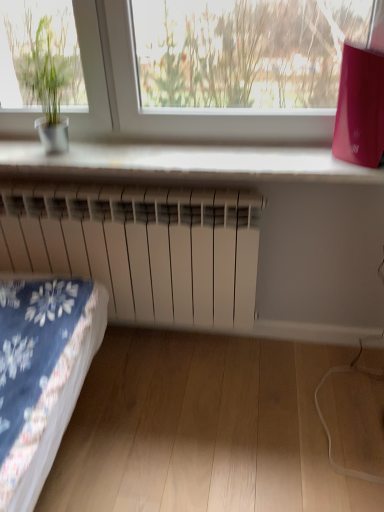
Question: From a real-world perspective, is white plastic radiator at lower center beneath white matte radiator at center?

Choices:
 (A) no
 (B) yes

Answer: (A)

Question: From the image's perspective, is white plastic radiator at lower center over white matte radiator at center?

Choices:
 (A) yes
 (B) no

Answer: (A)

Question: Does white plastic radiator at lower center have a greater height compared to white matte radiator at center?

Choices:
 (A) yes
 (B) no

Answer: (B)

Question: Could white matte radiator at center be considered to be inside white plastic radiator at lower center?

Choices:
 (A) no
 (B) yes

Answer: (A)

Question: Can you confirm if white plastic radiator at lower center is wider than white matte radiator at center?

Choices:
 (A) yes
 (B) no

Answer: (A)

Question: From the image's perspective, is white plastic radiator at lower center above or below white matte radiator at center?

Choices:
 (A) below
 (B) above

Answer: (B)

Question: Considering the positions of white plastic radiator at lower center and white matte radiator at center in the image, is white plastic radiator at lower center bigger or smaller than white matte radiator at center?

Choices:
 (A) big
 (B) small

Answer: (B)

Question: From a real-world perspective, is white plastic radiator at lower center above or below white matte radiator at center?

Choices:
 (A) below
 (B) above

Answer: (B)

Question: Is white plastic radiator at lower center in front of or behind white matte radiator at center in the image?

Choices:
 (A) front
 (B) behind

Answer: (A)

Question: From the image's perspective, is green matte plant pot at left above or below white plastic radiator at lower center?

Choices:
 (A) above
 (B) below

Answer: (A)

Question: Looking at their shapes, would you say green matte plant pot at left is wider or thinner than white plastic radiator at lower center?

Choices:
 (A) wide
 (B) thin

Answer: (B)

Question: From a real-world perspective, relative to white plastic radiator at lower center, is green matte plant pot at left vertically above or below?

Choices:
 (A) above
 (B) below

Answer: (A)

Question: Is point (59, 67) positioned closer to the camera than point (168, 152)?

Choices:
 (A) farther
 (B) closer

Answer: (B)

Question: Considering their positions, is green matte plant pot at left located in front of or behind white matte radiator at center?

Choices:
 (A) behind
 (B) front

Answer: (B)

Question: From a real-world perspective, is green matte plant pot at left physically located above or below white matte radiator at center?

Choices:
 (A) below
 (B) above

Answer: (B)